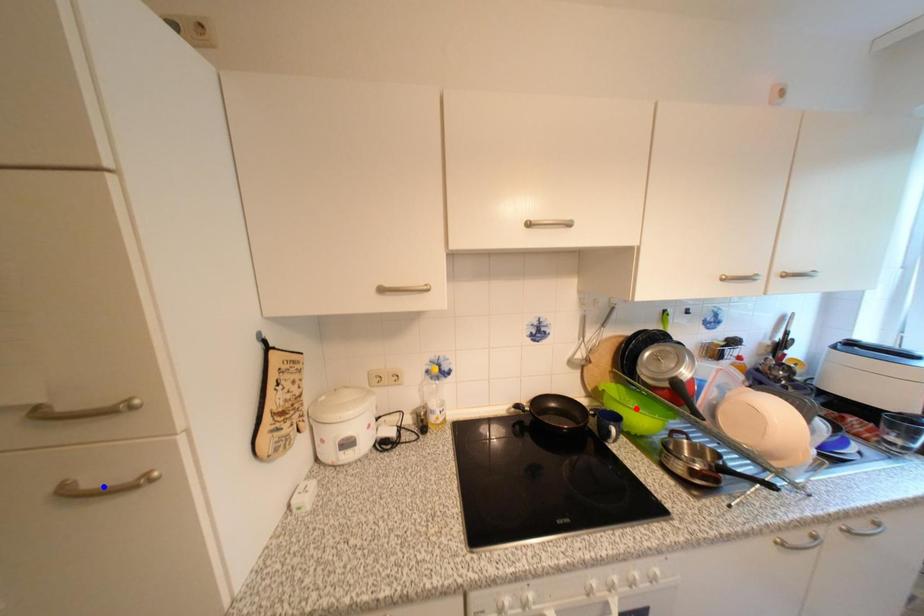
Question: In the image, two points are highlighted. Which point is nearer to the camera? Reply with the corresponding letter.

Choices:
 (A) blue point
 (B) red point

Answer: (A)